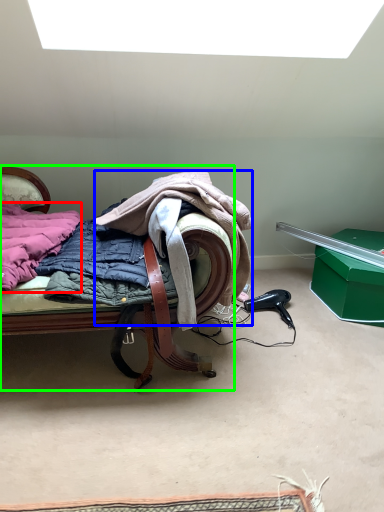
Question: Based on their relative distances, which object is farther from underclothes (highlighted by a red box)? Choose from cloak (highlighted by a blue box) and furniture (highlighted by a green box).

Choices:
 (A) cloak
 (B) furniture

Answer: (A)